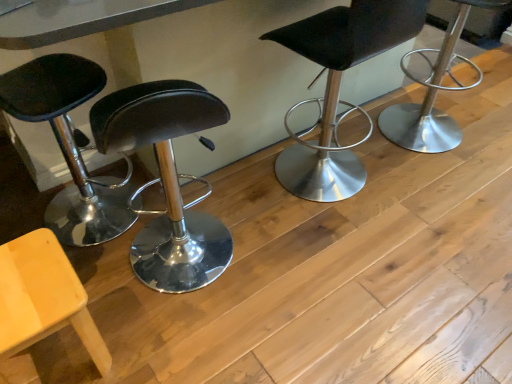
Question: From a real-world perspective, is polished silver stool at right, the first chair positioned from the right, physically located above or below black leather stool at center, the 3th chair in the left-to-right sequence?

Choices:
 (A) below
 (B) above

Answer: (A)

Question: Looking at the image, does polished silver stool at right, the 4th chair in the left-to-right sequence, seem bigger or smaller compared to black leather stool at center, positioned as the 2th chair in right-to-left order?

Choices:
 (A) small
 (B) big

Answer: (A)

Question: Which object is the farthest from the polished silver stool at right, the 4th chair in the left-to-right sequence?

Choices:
 (A) matte black stool at left, arranged as the fourth chair when viewed from the right
 (B) matte yellow chair at lower left, which ranks as the third chair in right-to-left order
 (C) black leather stool at center, the 3th chair in the left-to-right sequence

Answer: (B)

Question: Considering the real-world distances, which object is closest to the polished silver stool at right, the 4th chair in the left-to-right sequence?

Choices:
 (A) matte black stool at left, which appears as the 1th chair when viewed from the left
 (B) matte yellow chair at lower left, which ranks as the third chair in right-to-left order
 (C) black leather stool at center, the 3th chair in the left-to-right sequence

Answer: (C)